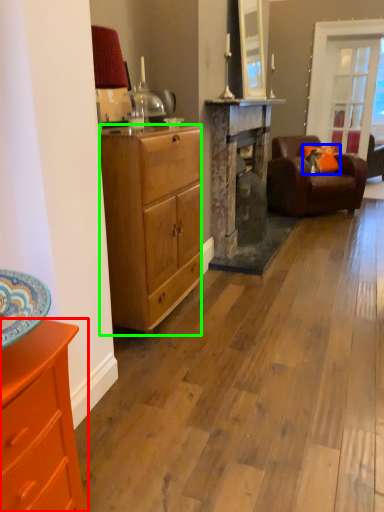
Question: Considering the real-world distances, which object is farthest from cabinetry (highlighted by a red box)? pillow (highlighted by a blue box) or desk (highlighted by a green box)?

Choices:
 (A) pillow
 (B) desk

Answer: (A)